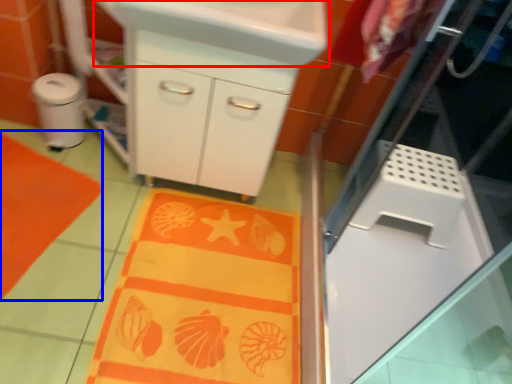
Question: Which of the following is the closest to the observer, sink (highlighted by a red box) or beach towel (highlighted by a blue box)?

Choices:
 (A) sink
 (B) beach towel

Answer: (A)